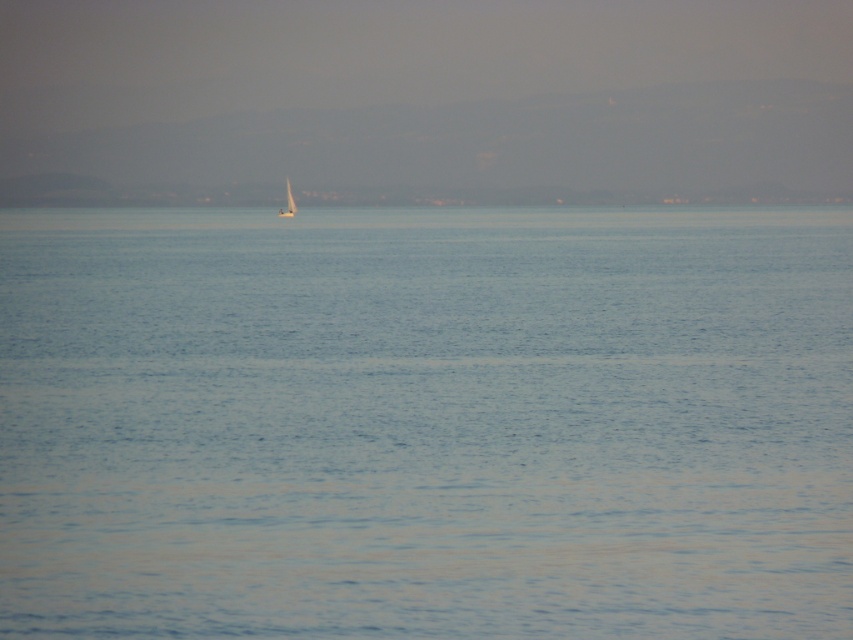
Can you confirm if blue smooth water at center is positioned above white matte sailboat at center?

No.

Does blue smooth water at center appear on the left side of white matte sailboat at center?

No, blue smooth water at center is not to the left of white matte sailboat at center.

The height and width of the screenshot is (640, 853). What are the coordinates of `blue smooth water at center` in the screenshot? It's located at (425, 422).

Locate an element on the screen. The image size is (853, 640). blue smooth water at center is located at coordinates click(x=425, y=422).

Does blue smooth water at center have a larger size compared to white sailboat at center?

Yes, blue smooth water at center is bigger than white sailboat at center.

Who is taller, blue smooth water at center or white sailboat at center?

Standing taller between the two is blue smooth water at center.

Describe the element at coordinates (425, 422) in the screenshot. This screenshot has height=640, width=853. I see `blue smooth water at center` at that location.

What are the coordinates of `blue smooth water at center` in the screenshot? It's located at (425, 422).

Who is higher up, blue water at center or white matte sailboat at center?

blue water at center is above.

Can you confirm if blue water at center is positioned above white matte sailboat at center?

Indeed, blue water at center is positioned over white matte sailboat at center.

Between point (341, 195) and point (289, 198), which one is positioned behind?

Point (341, 195)

Image resolution: width=853 pixels, height=640 pixels. I want to click on blue water at center, so click(x=556, y=195).